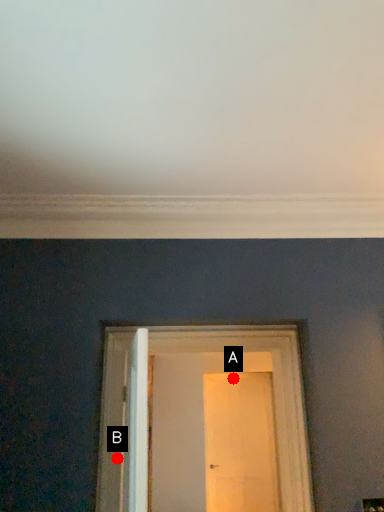
Question: Two points are circled on the image, labeled by A and B beside each circle. Among these points, which one is nearest to the camera?

Choices:
 (A) A is closer
 (B) B is closer

Answer: (B)